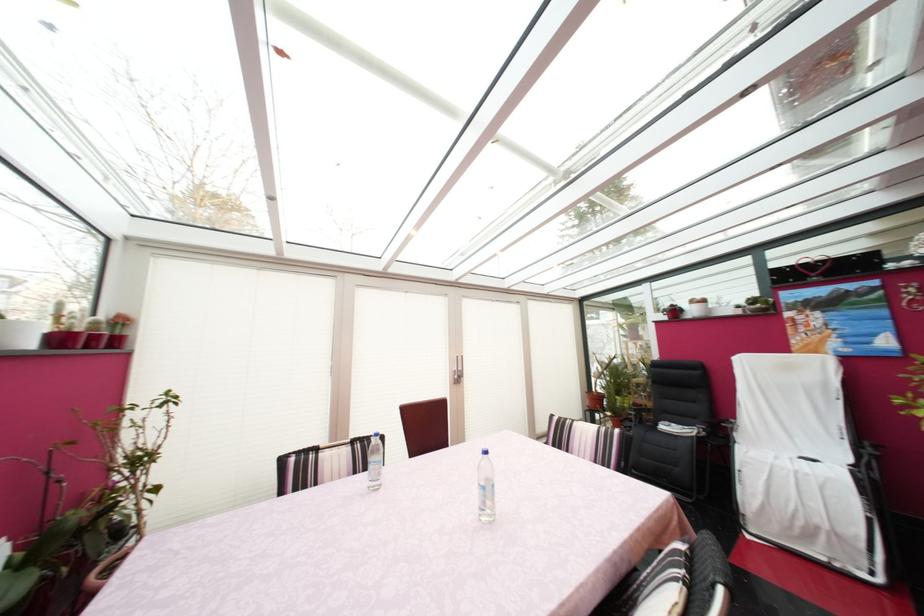
Locate an element on the screen. This screenshot has width=924, height=616. black chair armrest is located at coordinates (710, 429).